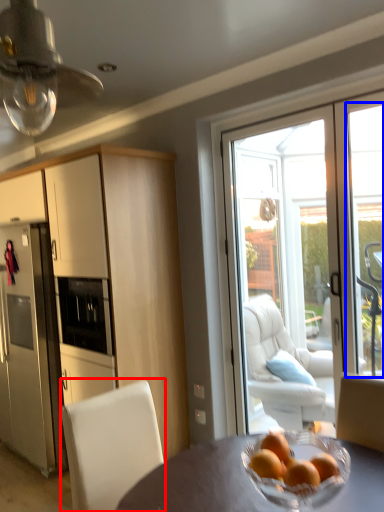
Question: Which point is further to the camera, chair (highlighted by a red box) or window (highlighted by a blue box)?

Choices:
 (A) chair
 (B) window

Answer: (B)